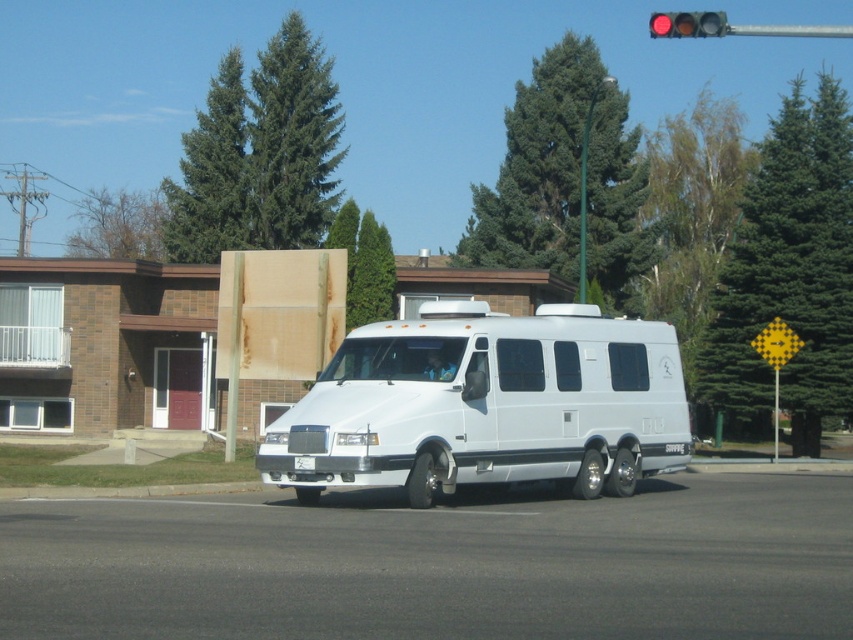
You are a delivery driver who needs to park your white matte van at center in a parking spot that is the same width as the red glass traffic light at upper center. Will the van fit in the parking spot?

The white matte van at center has a lesser width compared to the red glass traffic light at upper center, so the van will fit in the parking spot since it is narrower than the traffic light.

You are standing in front of the white van at the traffic light. You see two points marked on the van. The first point is at coordinates point (531,316) and the second point is at point (666,26). Which point is closer to you?

The point at (531,316) is closer to you than the point at (666,26).

Based on the photo, you are driving a car and want to pass the white matte van at center. The van is parked at a red traffic light. Your car is 15 meters behind the van. Can you safely pass the van on the right side without crossing into the oncoming traffic lane?

The white matte van at center is 22.37 meters from the camera. Since your car is 15 meters behind the van, there is a distance of 7.37 meters between you and the van. However, passing on the right side at a traffic light is generally unsafe and against traffic rules unless there is a designated passing lane. Therefore, it is not advisable to attempt passing the van on the right side in this scenario.